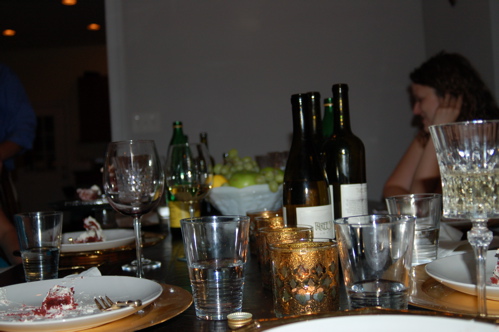
At what (x,y) coordinates should I click in order to perform the action: click on white wall. Please return your answer as a coordinate pair (x, y). The image size is (499, 332). Looking at the image, I should click on (249, 81), (476, 31).